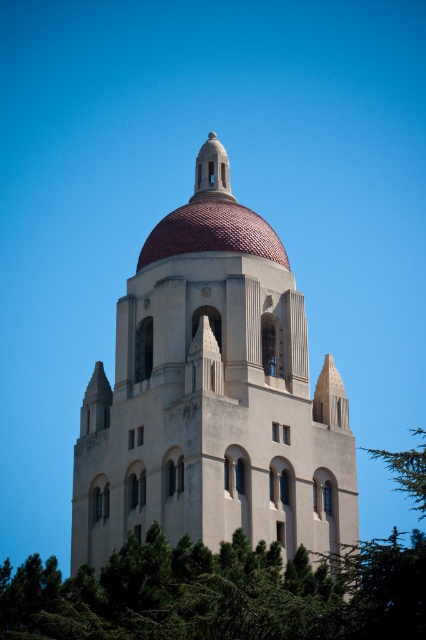
You are standing in front of the beige stone church at center and want to look up at the terracotta tiled dome at center. Which direction should you look to see the dome?

The beige stone church at center is positioned under the terracotta tiled dome at center, so you should look upward to see the dome above the church.

You are standing in front of the beige stone church at center and the green leafy tree at lower center. Which one is positioned more to the left?

The green leafy tree at lower center is positioned more to the left than the beige stone church at center.

You are a photographer standing in front of the beige stone church at center and the green leafy tree at lower center. You want to capture a wide shot that includes both objects in the frame. Which object should you position closer to the edge of the frame to ensure both fit comfortably?

The beige stone church at center is thinner than the green leafy tree at lower center, so positioning the beige stone church at center closer to the edge of the frame would allow both objects to fit comfortably in the shot.